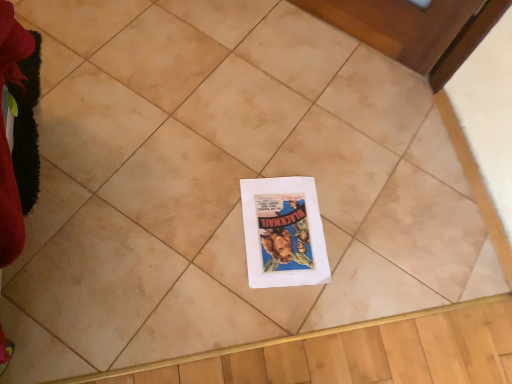
Image resolution: width=512 pixels, height=384 pixels. What are the coordinates of `white paper flyer at center` in the screenshot? It's located at (283, 232).

The height and width of the screenshot is (384, 512). What do you see at coordinates (283, 232) in the screenshot?
I see `white paper flyer at center` at bounding box center [283, 232].

Identify the location of white paper flyer at center. (283, 232).